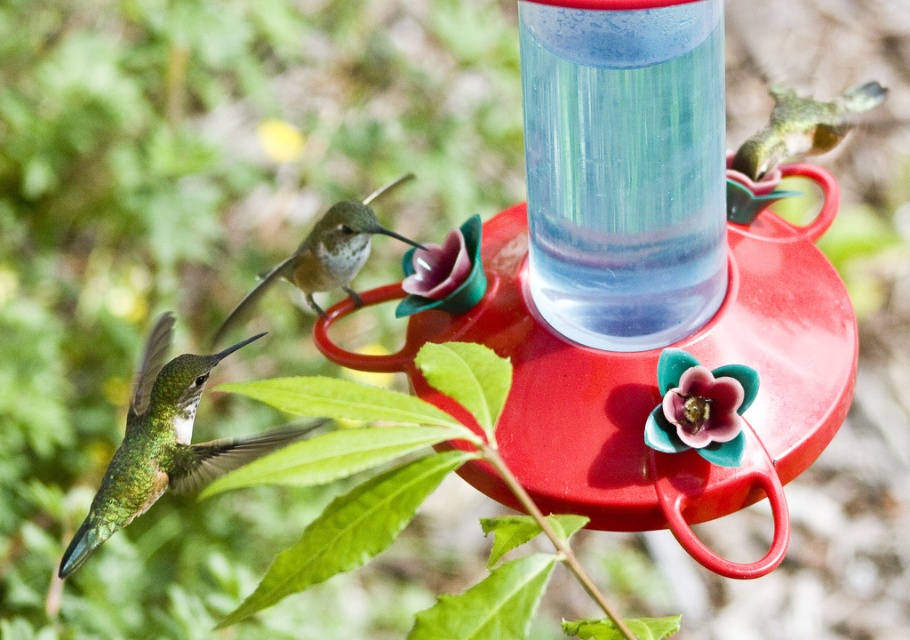
You are a photographer trying to capture the two points in the image. Which point, point (735,433) or point (421,268), would appear larger in your photo?

Point (735,433) is closer to the camera than point (421,268), so it would appear larger in the photo.

You are a birdwatcher trying to photograph the two hummingbirds. You notice the red plastic bird feeder at center and the pink matte flower at center. Which object is wider?

The red plastic bird feeder at center is wider than the pink matte flower at center.

You are holding a 10 inch long stick and want to reach the red plastic bird feeder at center to clean it. Can you reach it with your stick?

The red plastic bird feeder at center and viewer are 8.90 inches apart. The stick is 10 inches long, so yes, you can reach the red plastic bird feeder at center with the stick since it is within the stick length.